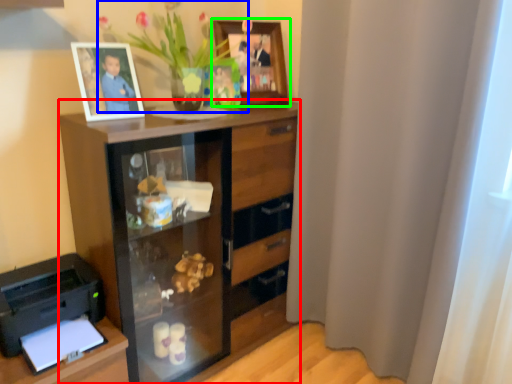
Question: Considering the real-world distances, which object is farthest from chest of drawers (highlighted by a red box)? floral arrangement (highlighted by a blue box) or picture frame (highlighted by a green box)?

Choices:
 (A) floral arrangement
 (B) picture frame

Answer: (B)